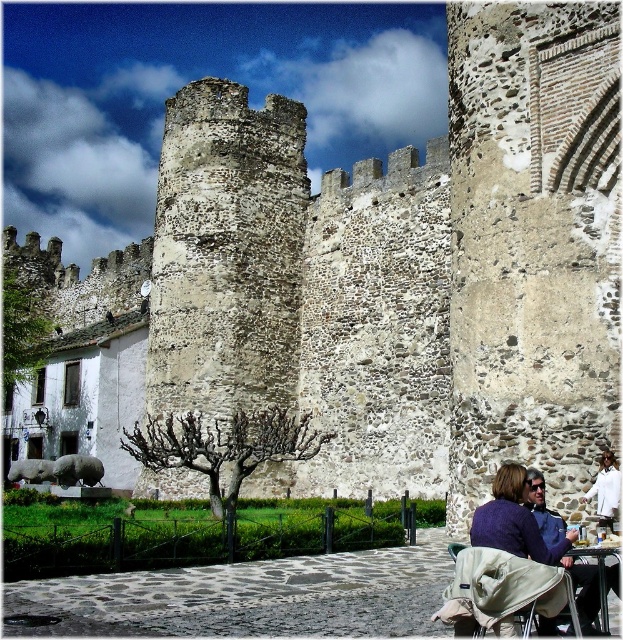
Question: Is beige fabric stroller at lower right smaller than metallic silver table at lower right?

Choices:
 (A) yes
 (B) no

Answer: (A)

Question: Among these points, which one is nearest to the camera?

Choices:
 (A) (506, 589)
 (B) (525, 518)

Answer: (A)

Question: Which point is closer to the camera taking this photo?

Choices:
 (A) (566, 563)
 (B) (483, 564)
 (C) (500, 513)

Answer: (B)

Question: Which object is farther from the camera taking this photo?

Choices:
 (A) beige fabric stroller at lower right
 (B) metallic silver table at lower right

Answer: (B)

Question: Can you confirm if purple woolen sweater at lower right is positioned above metallic silver table at lower right?

Choices:
 (A) no
 (B) yes

Answer: (A)

Question: Is purple woolen sweater at lower right bigger than metallic silver table at lower right?

Choices:
 (A) no
 (B) yes

Answer: (A)